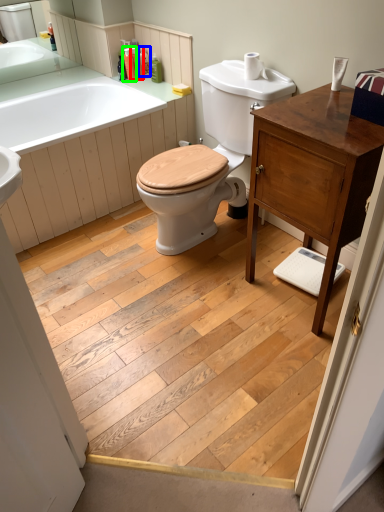
Question: Which object is positioned farthest from toiletry (highlighted by a red box)? Select from toiletry (highlighted by a blue box) and toiletry (highlighted by a green box).

Choices:
 (A) toiletry
 (B) toiletry

Answer: (A)